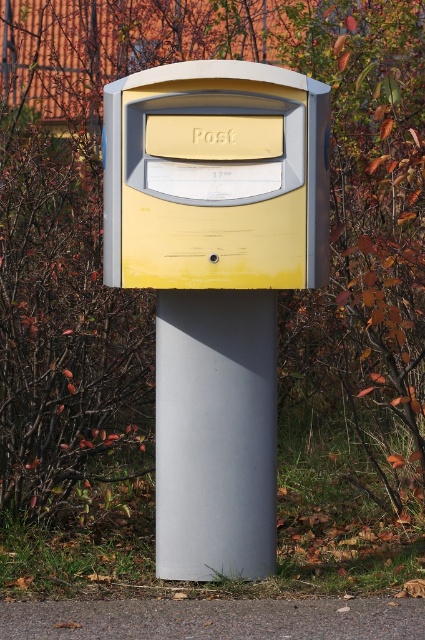
Question: Observing the image, what is the correct spatial positioning of yellow matte mailbox at center in reference to matte gray pole at center?

Choices:
 (A) left
 (B) right

Answer: (A)

Question: Which object appears closest to the camera in this image?

Choices:
 (A) matte gray pole at center
 (B) yellow matte mailbox at center

Answer: (B)

Question: Is yellow matte mailbox at center behind matte gray pole at center?

Choices:
 (A) yes
 (B) no

Answer: (B)

Question: Which point is closer to the camera?

Choices:
 (A) (237, 532)
 (B) (132, 113)

Answer: (B)

Question: Does yellow matte mailbox at center appear over matte gray pole at center?

Choices:
 (A) yes
 (B) no

Answer: (A)